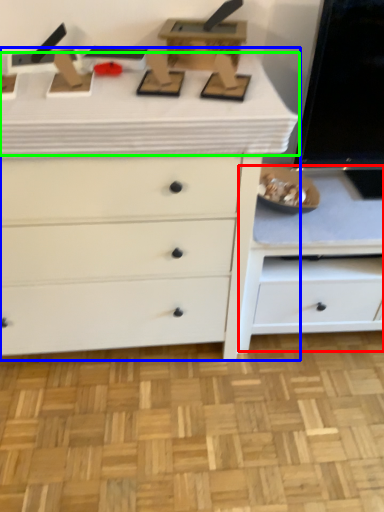
Question: Which object is positioned farthest from cabinetry (highlighted by a red box)? Select from chest of drawers (highlighted by a blue box) and counter top (highlighted by a green box).

Choices:
 (A) chest of drawers
 (B) counter top

Answer: (B)